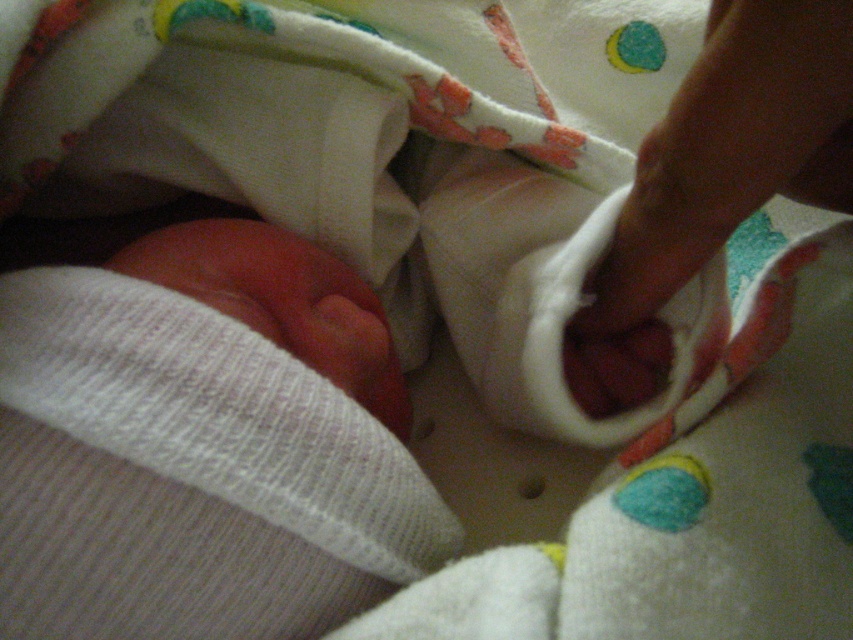
Question: From the image, what is the correct spatial relationship of smooth skin hand at center in relation to pink soft skin at center?

Choices:
 (A) below
 (B) above

Answer: (B)

Question: Can you confirm if smooth skin hand at center is thinner than pink soft skin at center?

Choices:
 (A) no
 (B) yes

Answer: (B)

Question: Does smooth skin hand at center have a larger size compared to pink soft skin at center?

Choices:
 (A) yes
 (B) no

Answer: (A)

Question: Which point appears farthest from the camera in this image?

Choices:
 (A) (682, 170)
 (B) (329, 340)

Answer: (B)

Question: Which point is closer to the camera?

Choices:
 (A) (332, 300)
 (B) (840, 202)

Answer: (B)

Question: Which point is closer to the camera?

Choices:
 (A) smooth skin hand at center
 (B) pink soft skin at center

Answer: (A)